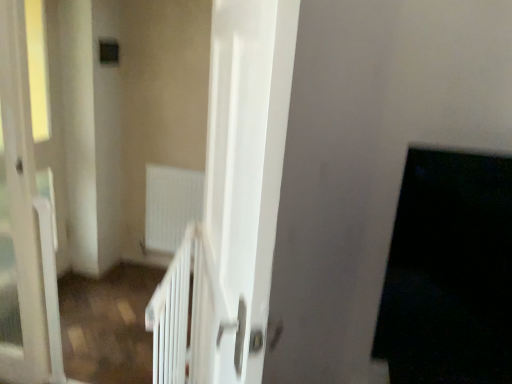
Question: Is white glossy door at center, which is the first screen door in right-to-left order, positioned behind white matte radiator at center?

Choices:
 (A) no
 (B) yes

Answer: (A)

Question: From the image's perspective, is white glossy door at center, which is the first screen door in right-to-left order, on top of white matte radiator at center?

Choices:
 (A) no
 (B) yes

Answer: (A)

Question: Is white glossy door at center, the 2th screen door from the left, completely or partially outside of white matte radiator at center?

Choices:
 (A) no
 (B) yes

Answer: (B)

Question: Is white glossy door at center, which is the first screen door in right-to-left order, directly adjacent to white matte radiator at center?

Choices:
 (A) no
 (B) yes

Answer: (A)

Question: Is white glossy door at center, which is the first screen door in right-to-left order, facing towards white matte radiator at center?

Choices:
 (A) yes
 (B) no

Answer: (B)

Question: Considering the relative positions of white glossy door at center, the 2th screen door from the left, and white matte radiator at center in the image provided, is white glossy door at center, the 2th screen door from the left, to the left of white matte radiator at center from the viewer's perspective?

Choices:
 (A) yes
 (B) no

Answer: (B)

Question: Is white glossy door at center, the 2th screen door from the left, positioned with its back to black matte door at right?

Choices:
 (A) yes
 (B) no

Answer: (A)

Question: Is white glossy door at center, the 2th screen door from the left, further to camera compared to black matte door at right?

Choices:
 (A) yes
 (B) no

Answer: (B)

Question: Is white glossy door at center, the 2th screen door from the left, taller than black matte door at right?

Choices:
 (A) yes
 (B) no

Answer: (A)

Question: From the image's perspective, is white glossy door at center, which is the first screen door in right-to-left order, located beneath black matte door at right?

Choices:
 (A) no
 (B) yes

Answer: (A)

Question: From a real-world perspective, is white glossy door at center, the 2th screen door from the left, physically below black matte door at right?

Choices:
 (A) yes
 (B) no

Answer: (B)

Question: Is white glossy door at center, the 2th screen door from the left, next to black matte door at right?

Choices:
 (A) no
 (B) yes

Answer: (A)

Question: From a real-world perspective, is black matte door at right physically above transparent glass screen door at left, placed as the 2th screen door when sorted from right to left?

Choices:
 (A) yes
 (B) no

Answer: (A)